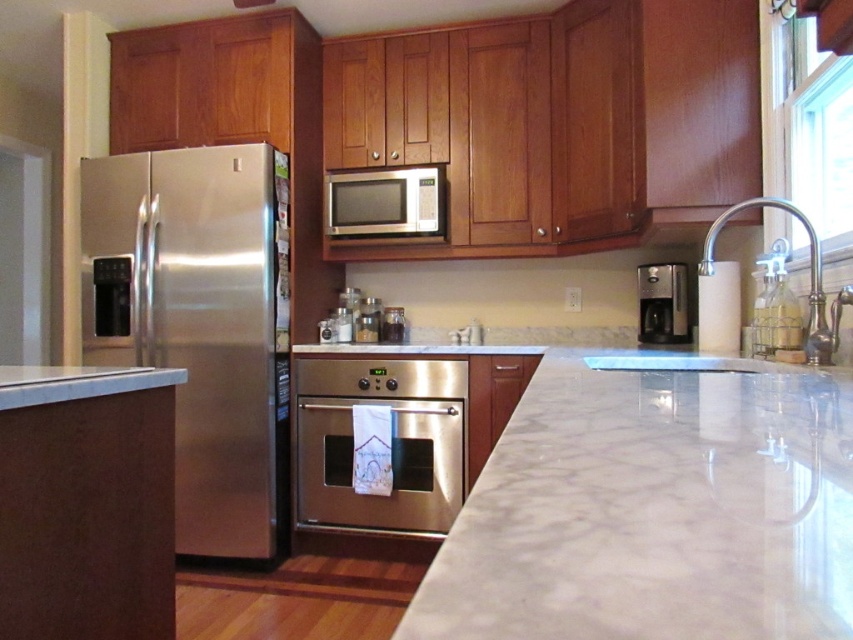
Which is above, white marble countertop at center or stainless steel refrigerator at left?

stainless steel refrigerator at left

Which of these two, white marble countertop at center or stainless steel refrigerator at left, stands taller?

With more height is stainless steel refrigerator at left.

The image size is (853, 640). Describe the element at coordinates (654, 509) in the screenshot. I see `white marble countertop at center` at that location.

Identify the location of white marble countertop at center. (654, 509).

Is point (339, 177) positioned before point (358, 336)?

Yes.

Between satin silver microwave at upper center and satin metallic canisters at center, which one appears on the right side from the viewer's perspective?

satin silver microwave at upper center

Is point (428, 204) positioned after point (375, 337)?

No, (428, 204) is in front of (375, 337).

This screenshot has width=853, height=640. I want to click on satin silver microwave at upper center, so click(x=386, y=202).

Which is below, satin metallic coffee maker at right or satin metallic canisters at center?

Positioned lower is satin metallic canisters at center.

Between satin metallic coffee maker at right and satin metallic canisters at center, which one appears on the left side from the viewer's perspective?

From the viewer's perspective, satin metallic canisters at center appears more on the left side.

Looking at this image, who is more distant from viewer, (682, 305) or (363, 307)?

Positioned behind is point (363, 307).

At what (x,y) coordinates should I click in order to perform the action: click on satin metallic coffee maker at right. Please return your answer as a coordinate pair (x, y). Image resolution: width=853 pixels, height=640 pixels. Looking at the image, I should click on (662, 304).